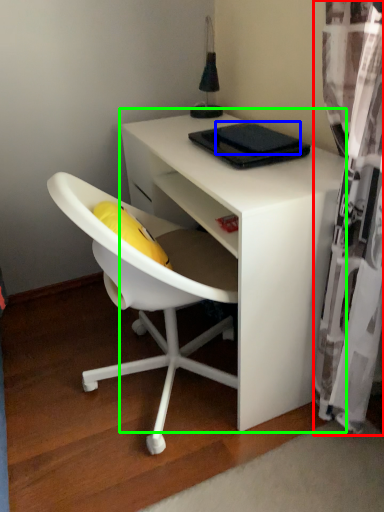
Question: Which object is positioned farthest from curtain (highlighted by a red box)? Select from pad (highlighted by a blue box) and desk (highlighted by a green box).

Choices:
 (A) pad
 (B) desk

Answer: (A)